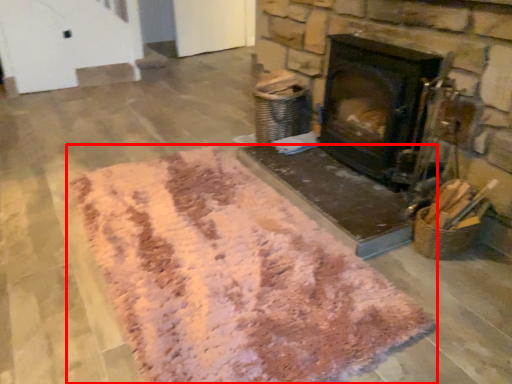
Question: Where is mat (annotated by the red box) located in relation to wood burning stove in the image?

Choices:
 (A) right
 (B) left

Answer: (B)